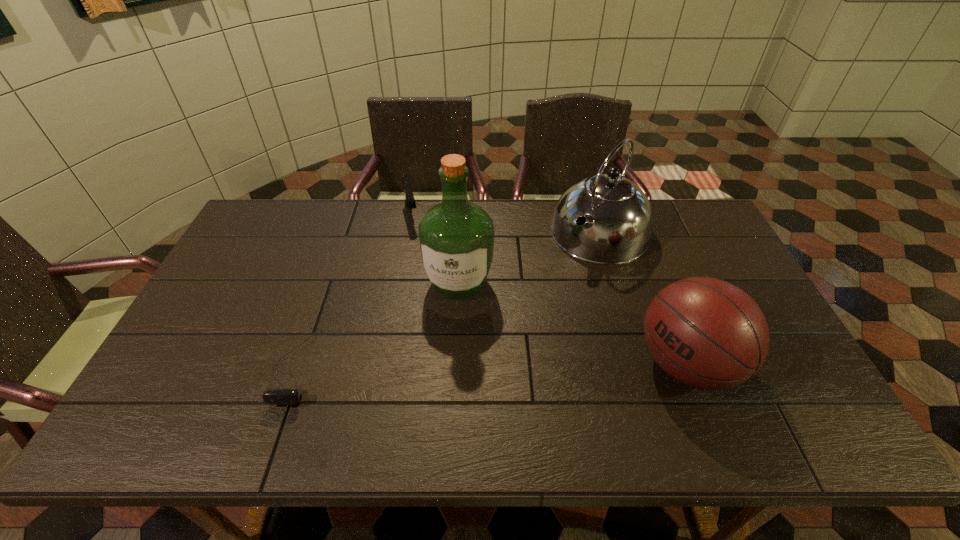
Locate an element on the screen. This screenshot has height=540, width=960. object that ranks as the third closest to the third object from right to left is located at coordinates (281, 396).

Identify the location of object identified as the fourth closest to the pistol. Image resolution: width=960 pixels, height=540 pixels. tap(706, 333).

Where is `vacant space that satisfies the following two spatial constraints: 1. on the back side of the tallest object; 2. on the right side of the second tallest object`? The width and height of the screenshot is (960, 540). vacant space that satisfies the following two spatial constraints: 1. on the back side of the tallest object; 2. on the right side of the second tallest object is located at coordinates (461, 232).

At what (x,y) coordinates should I click in order to perform the action: click on free space that satisfies the following two spatial constraints: 1. on the front side of the third tallest object; 2. on the left side of the tallest object. Please return your answer as a coordinate pair (x, y). The height and width of the screenshot is (540, 960). Looking at the image, I should click on (455, 363).

The height and width of the screenshot is (540, 960). Find the location of `vacant position in the image that satisfies the following two spatial constraints: 1. on the front side of the third shortest object; 2. on the left side of the third object from left to right`. vacant position in the image that satisfies the following two spatial constraints: 1. on the front side of the third shortest object; 2. on the left side of the third object from left to right is located at coordinates (455, 363).